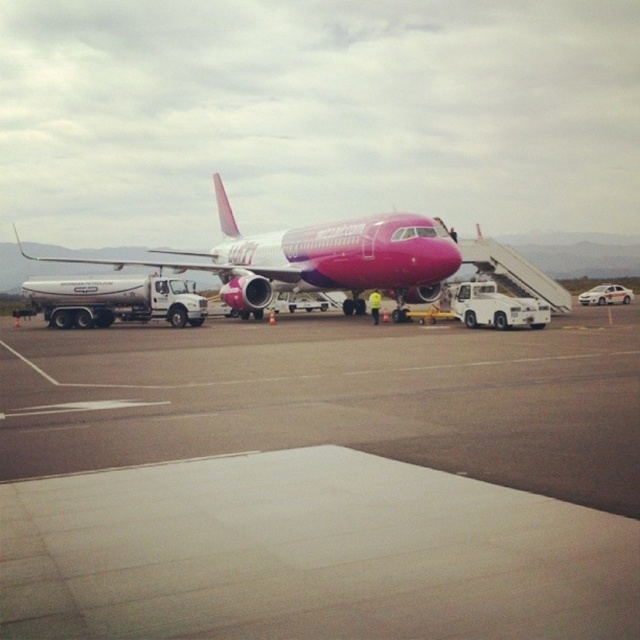
You are a maintenance worker standing on the smooth concrete tarmac at center. You need to place a heavy equipment box on a surface that is higher than the ground. Can you use the white metallic fuel truck at left as a surface for this task?

The smooth concrete tarmac at center has a lesser height compared to the white metallic fuel truck at left. Therefore, the white metallic fuel truck at left is higher and can be used as a surface for placing the heavy equipment box.

You are a maintenance worker assigned to inspect the distance between the smooth concrete tarmac at center and the pink glossy airplane at center. According to the airport safety guidelines, the minimum safe distance between an aircraft and any tarmac surface must be at least 15 meters to allow emergency vehicles to pass. Can you confirm if the current distance meets this requirement?

The smooth concrete tarmac at center is 16.02 meters away from the pink glossy airplane at center, which exceeds the minimum required 15 meters. Therefore, the current distance meets the safety guidelines.